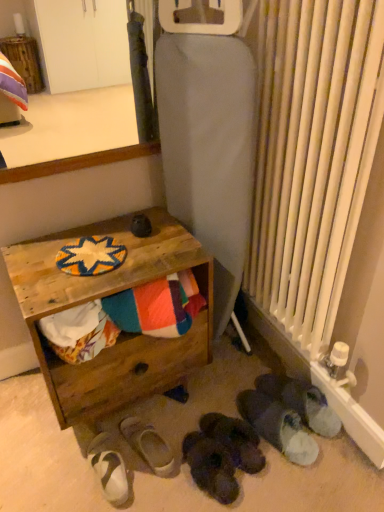
What are the coordinates of `vacant space to the left of dark gray suede slippers at lower center, the third footwear in the left-to-right sequence` in the screenshot? It's located at (156, 485).